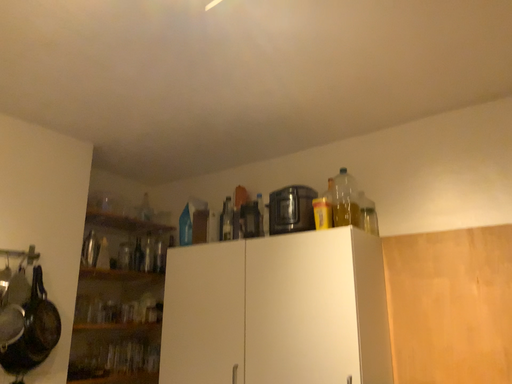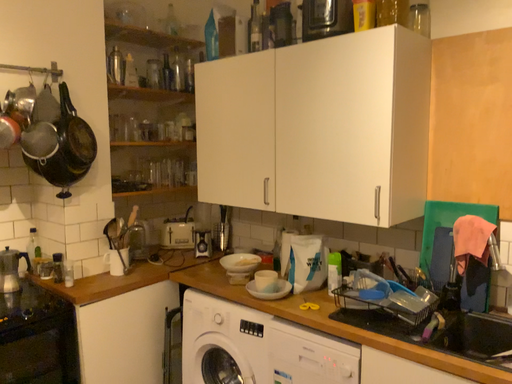
Question: Which way did the camera rotate in the video?

Choices:
 (A) rotated downward
 (B) rotated upward

Answer: (A)